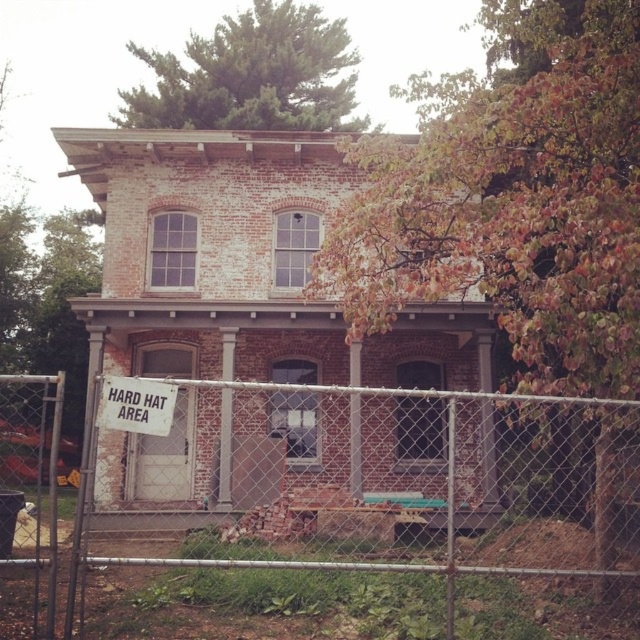
Question: Which of the following is the farthest from the observer?

Choices:
 (A) (632, 422)
 (B) (140, 404)

Answer: (A)

Question: Among these objects, which one is nearest to the camera?

Choices:
 (A) white paper sign at lower left
 (B) white chain-link fence at center

Answer: (B)

Question: Is white chain-link fence at center thinner than white paper sign at lower left?

Choices:
 (A) no
 (B) yes

Answer: (A)

Question: Which point is closer to the camera?

Choices:
 (A) (310, 525)
 (B) (104, 428)

Answer: (B)

Question: Is the position of white chain-link fence at center more distant than that of white paper sign at lower left?

Choices:
 (A) yes
 (B) no

Answer: (B)

Question: Is white chain-link fence at center closer to the viewer compared to white paper sign at lower left?

Choices:
 (A) yes
 (B) no

Answer: (A)